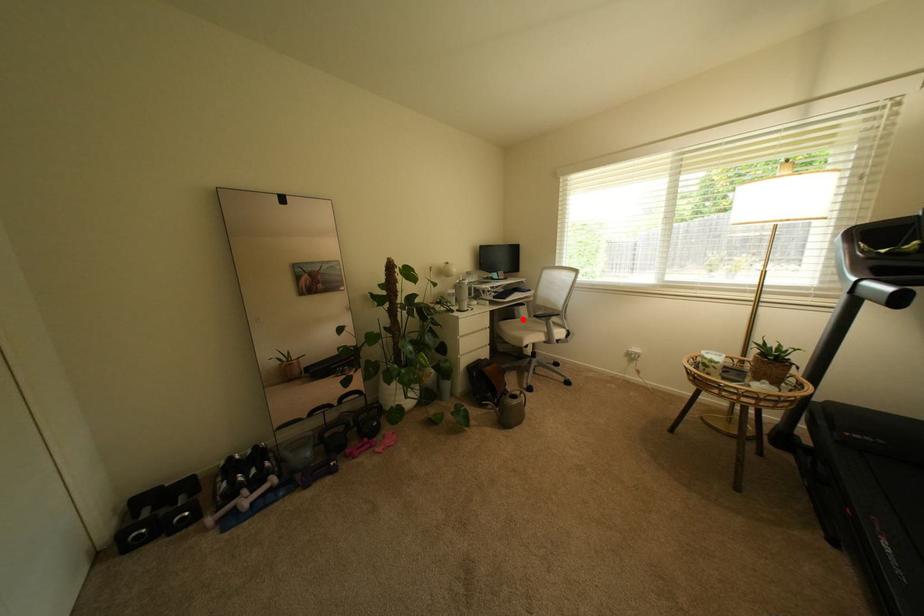
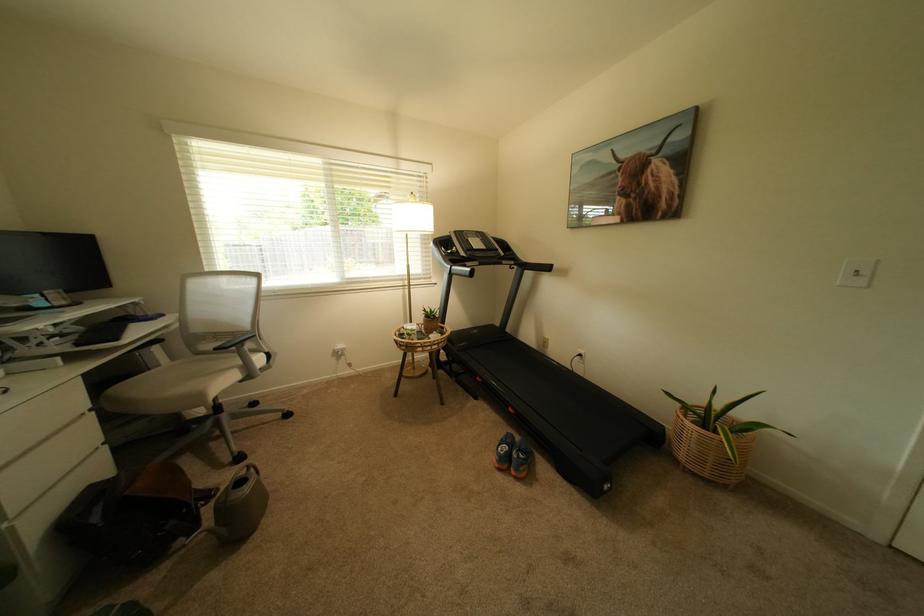
Question: A red point is marked in image1. In image2, is the corresponding 3D point closer to the camera or farther? Reply with the corresponding letter.

Choices:
 (A) The corresponding 3D point is closer.
 (B) The corresponding 3D point is farther.

Answer: (A)